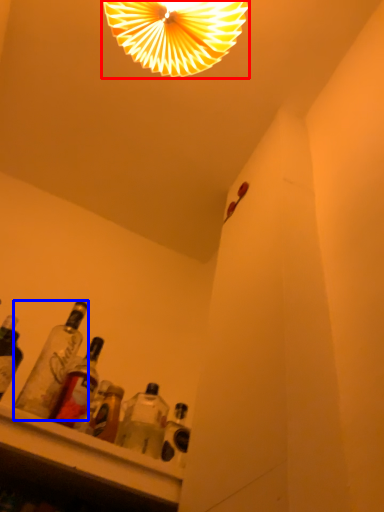
Question: Which point is closer to the camera, lamp (highlighted by a red box) or bottle (highlighted by a blue box)?

Choices:
 (A) lamp
 (B) bottle

Answer: (B)